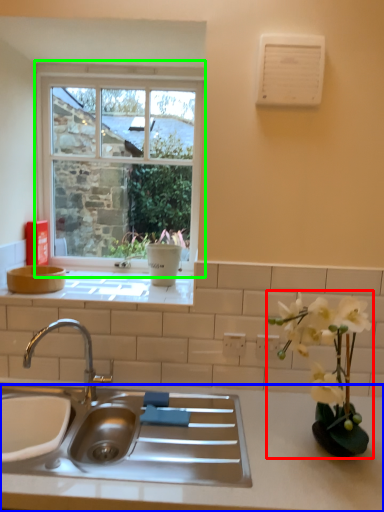
Question: Estimate the real-world distances between objects in this image. Which object is closer to houseplant (highlighted by a red box), countertop (highlighted by a blue box) or window (highlighted by a green box)?

Choices:
 (A) countertop
 (B) window

Answer: (A)